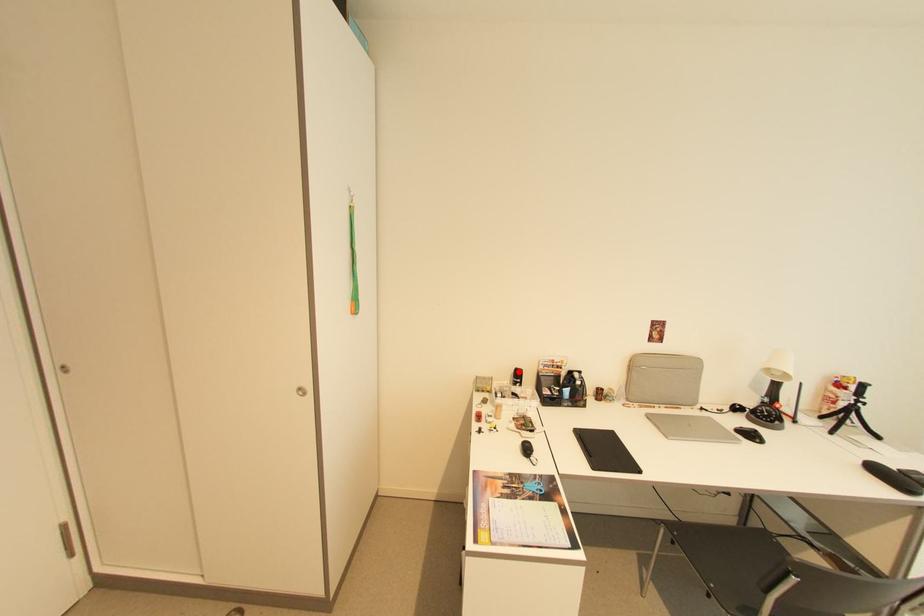
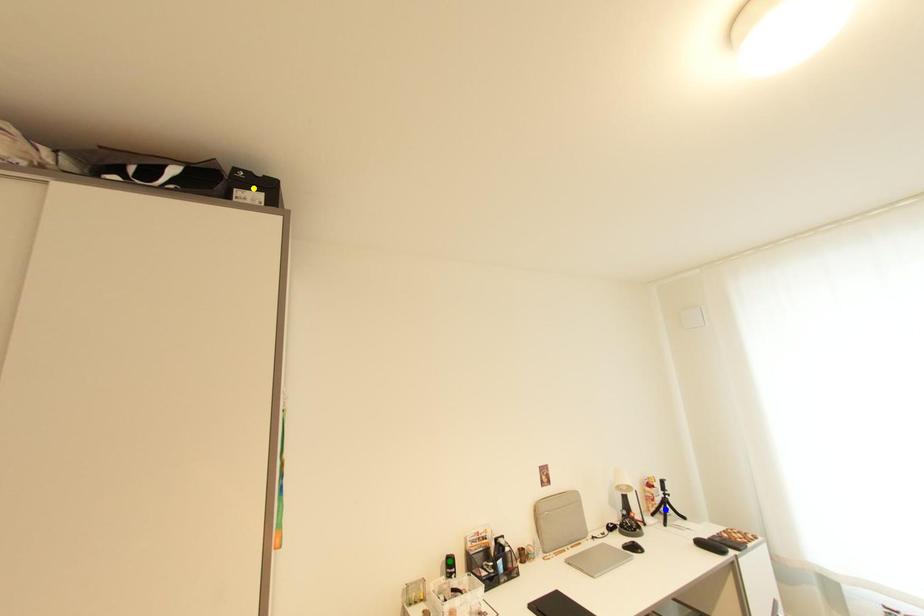
Question: I am providing you with two images of the same scene from different viewpoints. A red point is marked on the first image. You are given multiple points on the second image. Which spot in image 2 lines up with the point in image 1?

Choices:
 (A) blue point
 (B) green point
 (C) yellow point

Answer: (B)